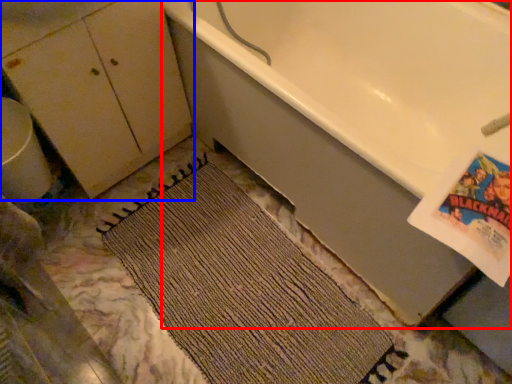
Question: Which object is closer to the camera taking this photo, bathtub (highlighted by a red box) or dresser (highlighted by a blue box)?

Choices:
 (A) bathtub
 (B) dresser

Answer: (A)